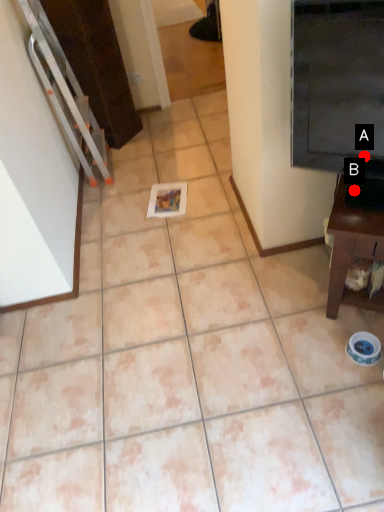
Question: Two points are circled on the image, labeled by A and B beside each circle. Among these points, which one is nearest to the camera?

Choices:
 (A) A is closer
 (B) B is closer

Answer: (A)